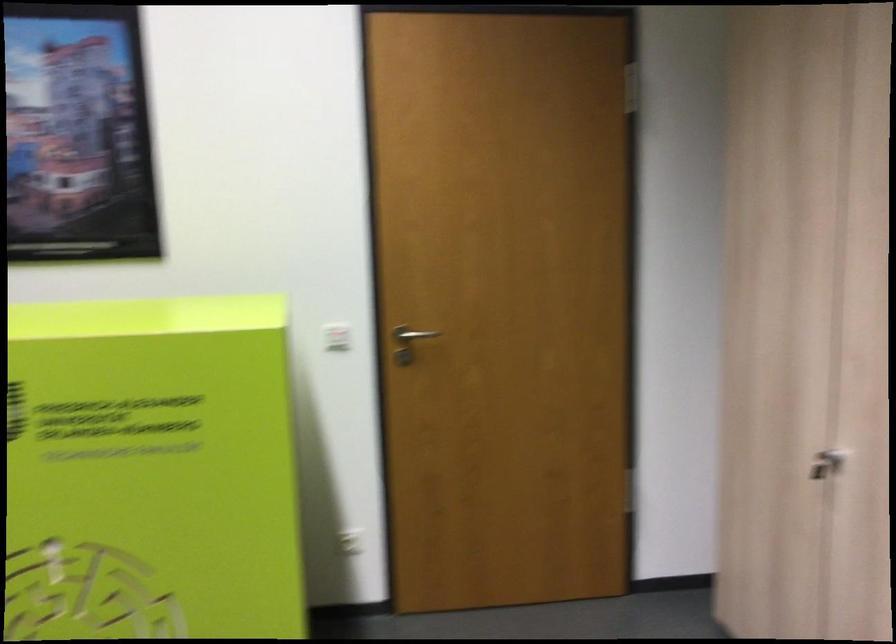
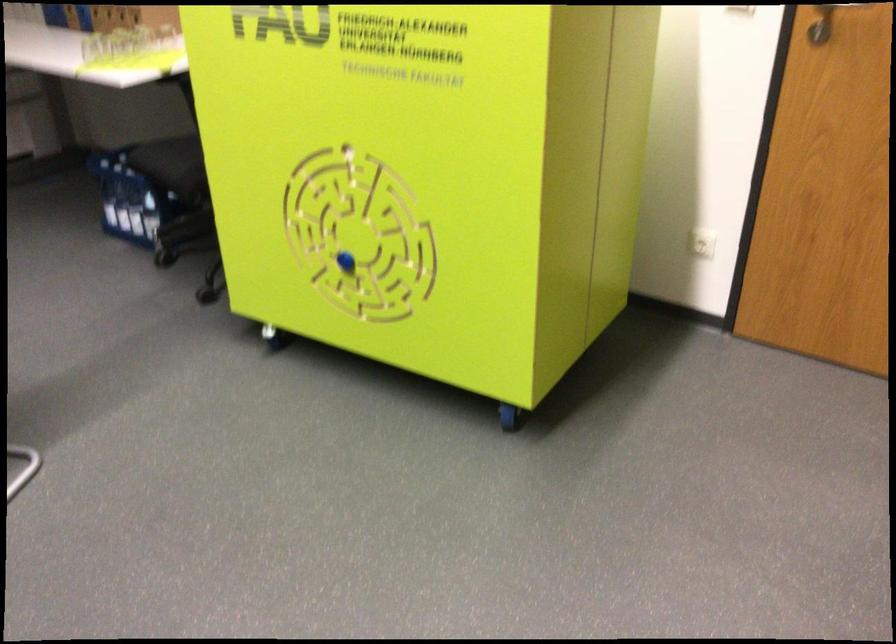
Where in the second image is the point corresponding to pixel 359 534 from the first image?

(702, 243)